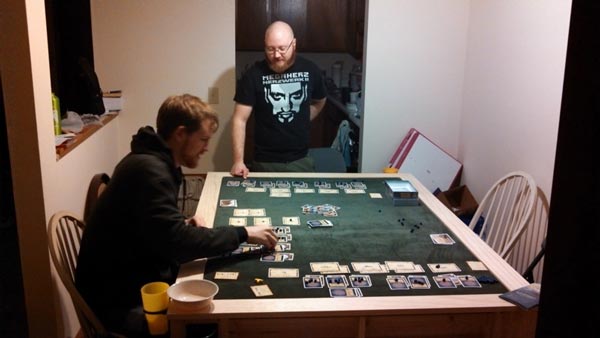
Find the location of a particular element. cabinets is located at coordinates (328, 26), (290, 17), (247, 20), (356, 24).